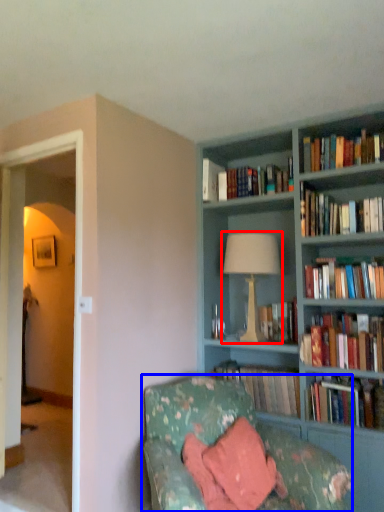
Question: Which of the following is the farthest to the observer, table lamp (highlighted by a red box) or studio couch (highlighted by a blue box)?

Choices:
 (A) table lamp
 (B) studio couch

Answer: (A)